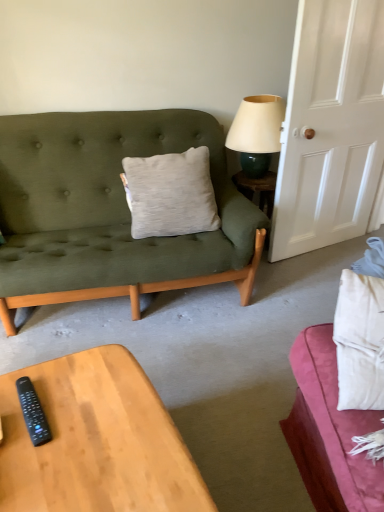
Question: From the image's perspective, does white matte door at right appear lower than black plastic remote at lower left?

Choices:
 (A) no
 (B) yes

Answer: (A)

Question: Is white matte door at right at the left side of black plastic remote at lower left?

Choices:
 (A) yes
 (B) no

Answer: (B)

Question: Is black plastic remote at lower left at the back of white matte door at right?

Choices:
 (A) yes
 (B) no

Answer: (B)

Question: Is white matte door at right smaller than black plastic remote at lower left?

Choices:
 (A) no
 (B) yes

Answer: (A)

Question: Is white matte door at right not near black plastic remote at lower left?

Choices:
 (A) yes
 (B) no

Answer: (A)

Question: Based on their sizes in the image, would you say matte green glass lamp at upper right is bigger or smaller than light gray cotton pillow at center?

Choices:
 (A) big
 (B) small

Answer: (B)

Question: In terms of width, does matte green glass lamp at upper right look wider or thinner when compared to light gray cotton pillow at center?

Choices:
 (A) wide
 (B) thin

Answer: (A)

Question: From a real-world perspective, relative to light gray cotton pillow at center, is matte green glass lamp at upper right vertically above or below?

Choices:
 (A) above
 (B) below

Answer: (A)

Question: In the image, is matte green glass lamp at upper right positioned in front of or behind light gray cotton pillow at center?

Choices:
 (A) front
 (B) behind

Answer: (B)

Question: Relative to wooden coffee table at lower left, is white matte door at right in front or behind?

Choices:
 (A) front
 (B) behind

Answer: (B)

Question: Based on their sizes in the image, would you say white matte door at right is bigger or smaller than wooden coffee table at lower left?

Choices:
 (A) big
 (B) small

Answer: (A)

Question: Is white matte door at right wider or thinner than wooden coffee table at lower left?

Choices:
 (A) thin
 (B) wide

Answer: (A)

Question: From a real-world perspective, is white matte door at right positioned above or below wooden coffee table at lower left?

Choices:
 (A) below
 (B) above

Answer: (B)

Question: Is white matte door at right in front of or behind matte green glass lamp at upper right in the image?

Choices:
 (A) front
 (B) behind

Answer: (A)

Question: From a real-world perspective, is white matte door at right physically located above or below matte green glass lamp at upper right?

Choices:
 (A) below
 (B) above

Answer: (A)